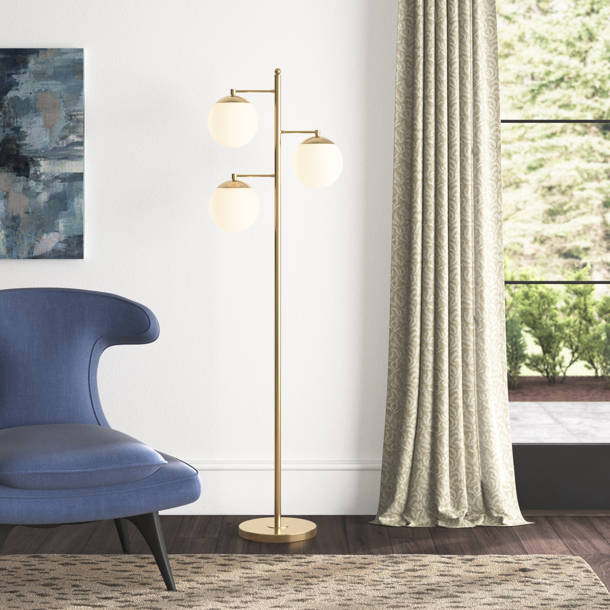
Where is `grey pattered curtain`? The width and height of the screenshot is (610, 610). grey pattered curtain is located at coordinates (403, 249).